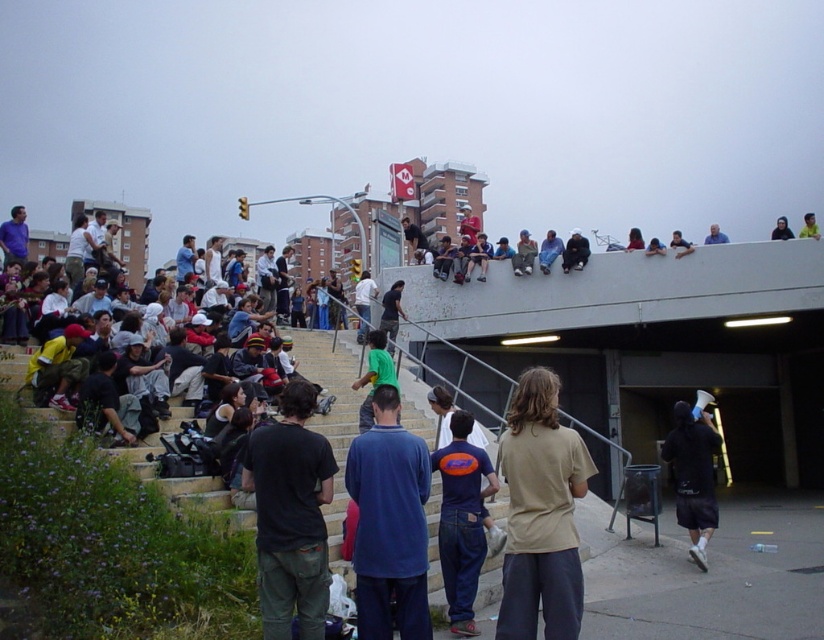
Is black cotton t-shirt at lower left closer to the viewer compared to green t-shirt at center?

Yes, it is in front of green t-shirt at center.

Does black cotton t-shirt at lower left have a lesser height compared to green t-shirt at center?

In fact, black cotton t-shirt at lower left may be taller than green t-shirt at center.

At what (x,y) coordinates should I click in order to perform the action: click on black cotton t-shirt at lower left. Please return your answer as a coordinate pair (x, y). Looking at the image, I should click on (289, 515).

Locate an element on the screen. The image size is (824, 640). black cotton t-shirt at lower left is located at coordinates (289, 515).

Who is shorter, beige cotton shirt at center or green fabric shirt at center?

Standing shorter between the two is green fabric shirt at center.

From the picture: How distant is beige cotton shirt at center from green fabric shirt at center?

They are 14.24 meters apart.

The height and width of the screenshot is (640, 824). What are the coordinates of `beige cotton shirt at center` in the screenshot? It's located at (541, 513).

Locate an element on the screen. The width and height of the screenshot is (824, 640). black cotton t-shirt at lower left is located at coordinates (289, 515).

Is black cotton t-shirt at lower left further to camera compared to dark blue shorts at lower right?

That is False.

At what (x,y) coordinates should I click in order to perform the action: click on black cotton t-shirt at lower left. Please return your answer as a coordinate pair (x, y). Looking at the image, I should click on (289, 515).

Identify the location of black cotton t-shirt at lower left. (289, 515).